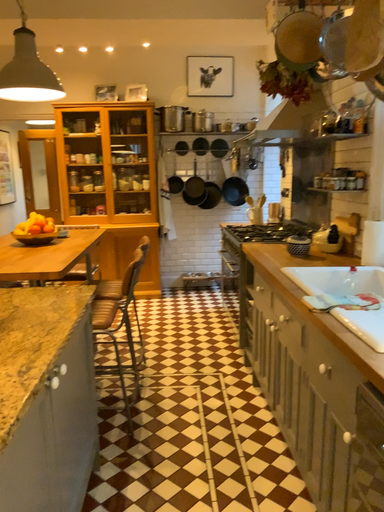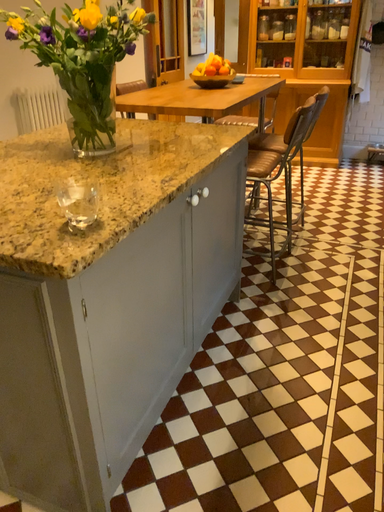
Question: Which way did the camera rotate in the video?

Choices:
 (A) rotated left
 (B) rotated right

Answer: (A)